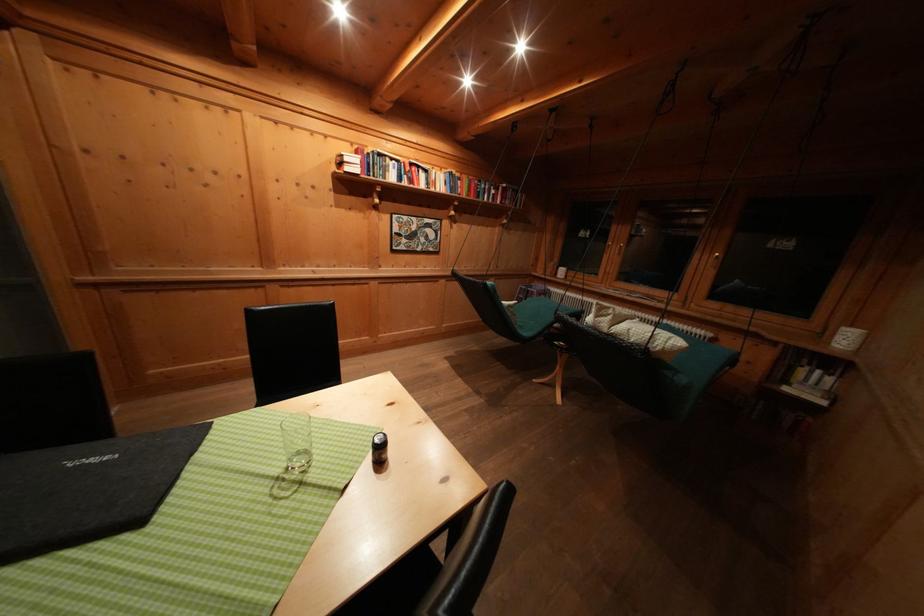
Which object does [420,176] point to?

It corresponds to the book on shelf in the image.